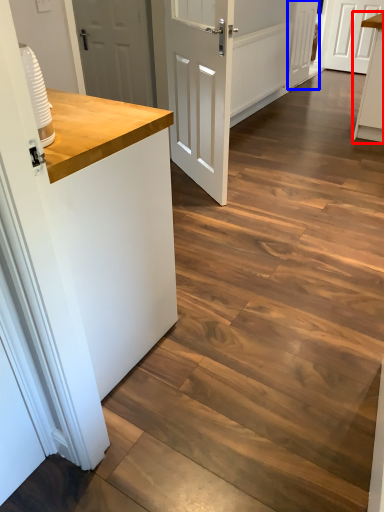
Question: Which object appears farthest to the camera in this image, cabinetry (highlighted by a red box) or door (highlighted by a blue box)?

Choices:
 (A) cabinetry
 (B) door

Answer: (B)